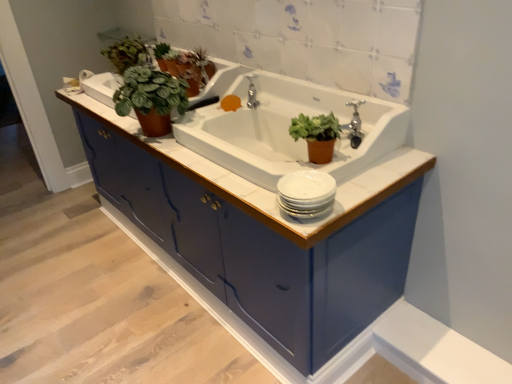
Question: Is green matte plant at upper left, acting as the 3th houseplant starting from the right, taller than white glossy sink at center?

Choices:
 (A) yes
 (B) no

Answer: (B)

Question: Considering the relative sizes of green matte plant at upper left, the first houseplant in the top-to-bottom sequence, and white glossy sink at center in the image provided, is green matte plant at upper left, the first houseplant in the top-to-bottom sequence, wider than white glossy sink at center?

Choices:
 (A) no
 (B) yes

Answer: (A)

Question: From the image's perspective, would you say green matte plant at upper left, which is counted as the 3th houseplant, starting from the front, is shown under white glossy sink at center?

Choices:
 (A) no
 (B) yes

Answer: (A)

Question: Considering the relative sizes of green matte plant at upper left, placed as the 1th houseplant when sorted from back to front, and white glossy sink at center in the image provided, is green matte plant at upper left, placed as the 1th houseplant when sorted from back to front, shorter than white glossy sink at center?

Choices:
 (A) no
 (B) yes

Answer: (B)

Question: Does green matte plant at upper left, the third houseplant positioned from the bottom, lie in front of white glossy sink at center?

Choices:
 (A) yes
 (B) no

Answer: (B)

Question: Is green matte plant at upper left, the third houseplant positioned from the bottom, aimed at white glossy sink at center?

Choices:
 (A) no
 (B) yes

Answer: (A)

Question: Is green matte plant at upper center smaller than matte blue cabinet at center?

Choices:
 (A) yes
 (B) no

Answer: (A)

Question: Considering the relative sizes of green matte plant at upper center and matte blue cabinet at center in the image provided, is green matte plant at upper center taller than matte blue cabinet at center?

Choices:
 (A) yes
 (B) no

Answer: (B)

Question: Is green matte plant at upper center not close to matte blue cabinet at center?

Choices:
 (A) no
 (B) yes

Answer: (A)

Question: From a real-world perspective, does green matte plant at upper center stand above matte blue cabinet at center?

Choices:
 (A) yes
 (B) no

Answer: (A)

Question: From the image's perspective, is green matte plant at upper center under matte blue cabinet at center?

Choices:
 (A) yes
 (B) no

Answer: (B)

Question: Considering the relative sizes of green matte plant at upper center and matte blue cabinet at center in the image provided, is green matte plant at upper center wider than matte blue cabinet at center?

Choices:
 (A) yes
 (B) no

Answer: (B)

Question: Is white glossy sink at center further to camera compared to green matte plant at upper left, placed as the 1th houseplant when sorted from back to front?

Choices:
 (A) yes
 (B) no

Answer: (B)